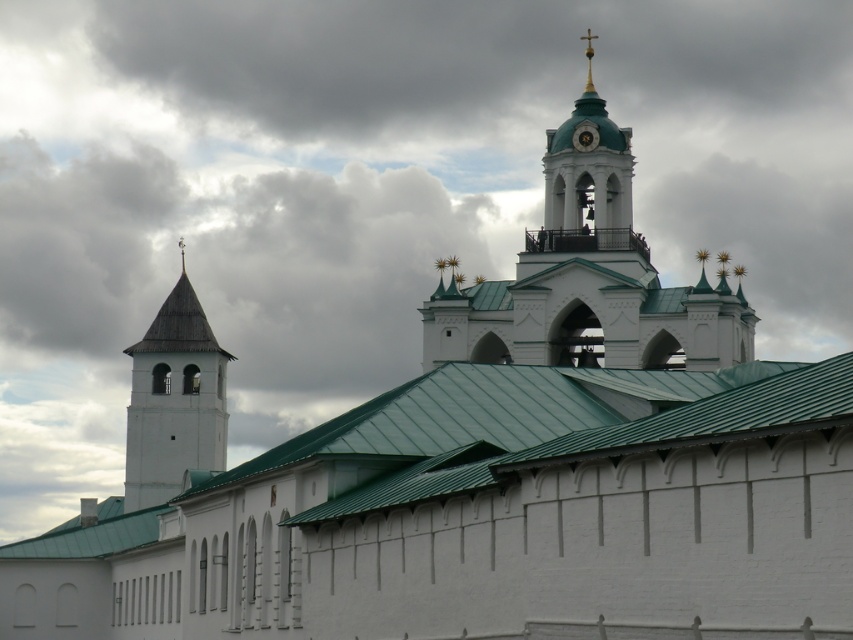
Question: Which of these objects is positioned farthest from the gold metallic clock at upper center?

Choices:
 (A) white stone tower at left
 (B) green matte bell tower at upper center

Answer: (A)

Question: Among these objects, which one is farthest from the camera?

Choices:
 (A) gold metallic clock at upper center
 (B) white stone tower at left
 (C) green matte bell tower at upper center

Answer: (B)

Question: Among these points, which one is nearest to the camera?

Choices:
 (A) (560, 193)
 (B) (165, 419)

Answer: (A)

Question: Can you confirm if white stone tower at left is wider than gold metallic clock at upper center?

Choices:
 (A) no
 (B) yes

Answer: (B)

Question: Can you confirm if green matte bell tower at upper center is bigger than gold metallic clock at upper center?

Choices:
 (A) no
 (B) yes

Answer: (B)

Question: Can you confirm if green matte bell tower at upper center is bigger than gold metallic clock at upper center?

Choices:
 (A) yes
 (B) no

Answer: (A)